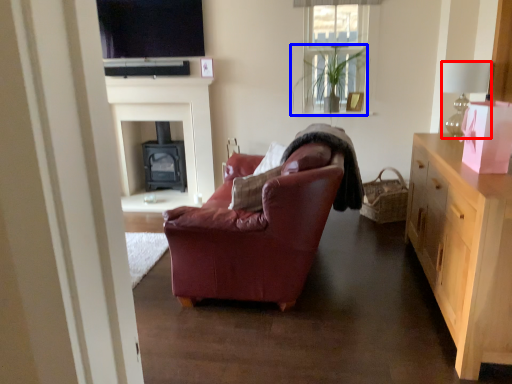
Question: Among these objects, which one is nearest to the camera, lamp (highlighted by a red box) or houseplant (highlighted by a blue box)?

Choices:
 (A) lamp
 (B) houseplant

Answer: (A)